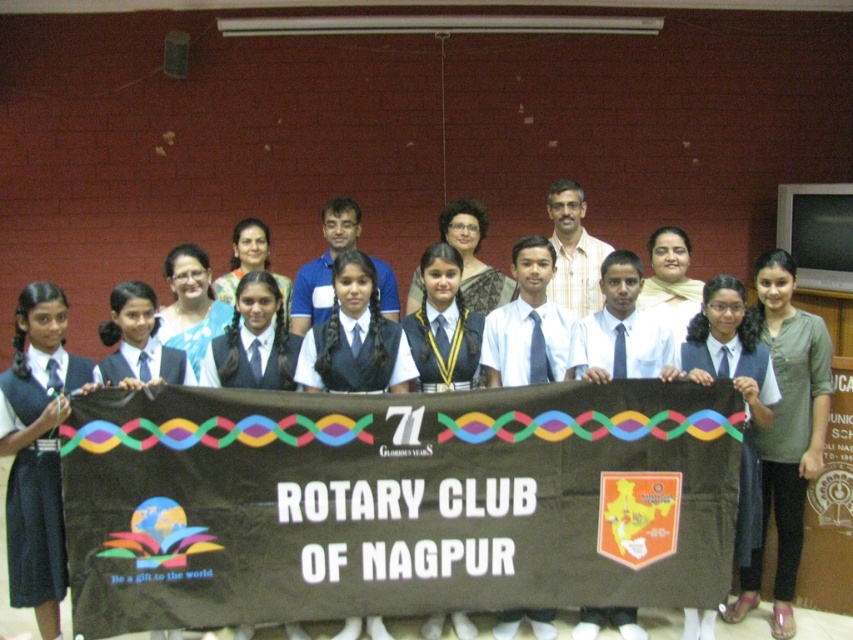
Question: Considering the relative positions of matte black tie at center and green fabric dress at center in the image provided, where is matte black tie at center located with respect to green fabric dress at center?

Choices:
 (A) right
 (B) left

Answer: (B)

Question: Which point is closer to the camera?

Choices:
 (A) (566, 564)
 (B) (6, 497)

Answer: (B)

Question: From the image, what is the correct spatial relationship of brown fabric banner at center in relation to matte black tie at left?

Choices:
 (A) below
 (B) above

Answer: (A)

Question: Can you confirm if brown fabric banner at center is positioned to the right of matte black tie at center?

Choices:
 (A) yes
 (B) no

Answer: (A)

Question: Which point is farther from the camera taking this photo?

Choices:
 (A) (807, 404)
 (B) (585, 570)
 (C) (30, 307)
 (D) (68, 456)

Answer: (A)

Question: Among these points, which one is nearest to the camera?

Choices:
 (A) (567, 529)
 (B) (239, 508)
 (C) (22, 548)

Answer: (C)